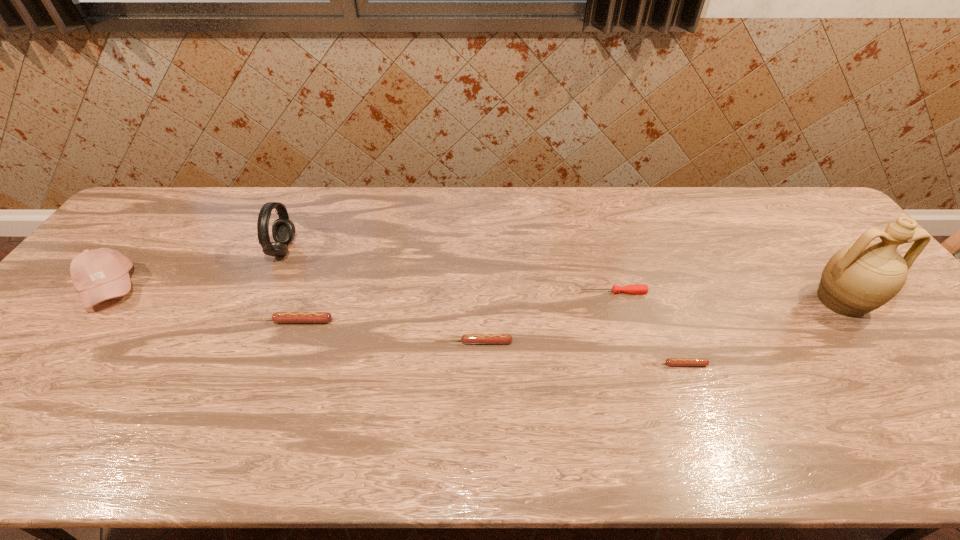
Please point out where to position a new sausage on the right to maintain spacing. Please provide its 2D coordinates. Your answer should be formatted as a tuple, i.e. [(x, y)], where the tuple contains the x and y coordinates of a point satisfying the conditions above.

[(895, 389)]